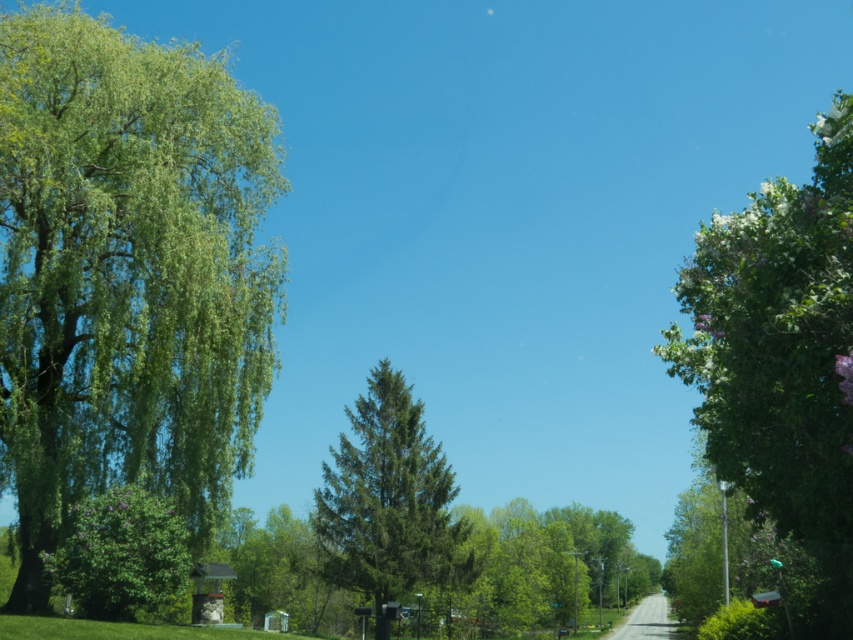
Is green leafy tree at left wider than purple leafy tree at center-left?

Yes, green leafy tree at left is wider than purple leafy tree at center-left.

Between point (123, 460) and point (64, 579), which one is positioned behind?

Positioned behind is point (123, 460).

I want to click on green leafy tree at left, so click(126, 273).

Looking at this image, who is more distant from viewer, (9, 20) or (844, 584)?

Point (9, 20)

Does point (131, 260) come farther from viewer compared to point (833, 556)?

Yes, it is.

Image resolution: width=853 pixels, height=640 pixels. Describe the element at coordinates (126, 273) in the screenshot. I see `green leafy tree at left` at that location.

Where is `green leafy tree at left`? Image resolution: width=853 pixels, height=640 pixels. green leafy tree at left is located at coordinates (126, 273).

Between green leafy tree at right and green matte tree at center, which one has less height?

green matte tree at center

Does green leafy tree at right have a greater width compared to green matte tree at center?

Correct, the width of green leafy tree at right exceeds that of green matte tree at center.

The height and width of the screenshot is (640, 853). Describe the element at coordinates (781, 353) in the screenshot. I see `green leafy tree at right` at that location.

You are a GUI agent. You are given a task and a screenshot of the screen. Output one action in this format:
    pyautogui.click(x=<x>, y=<y>)
    Task: Click on the green leafy tree at right
    
    Given the screenshot: What is the action you would take?
    pyautogui.click(x=781, y=353)